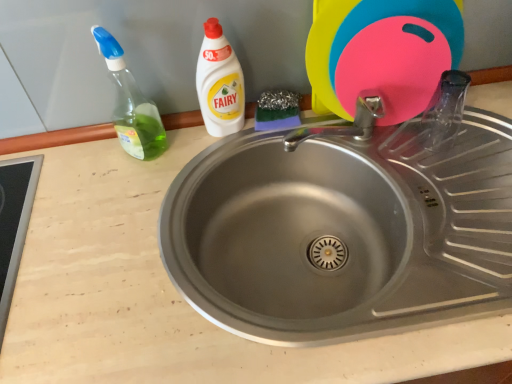
Find the location of a particular element. This screenshot has height=384, width=512. vacant area that lies to the right of green translucent bottle at left is located at coordinates (201, 148).